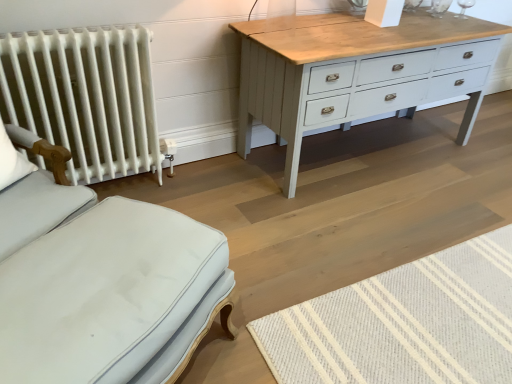
Question: Is white painted radiator at left to the right of natural wool mat at lower right from the viewer's perspective?

Choices:
 (A) no
 (B) yes

Answer: (A)

Question: From the image's perspective, is white painted radiator at left over natural wool mat at lower right?

Choices:
 (A) yes
 (B) no

Answer: (A)

Question: Is white painted radiator at left touching natural wool mat at lower right?

Choices:
 (A) no
 (B) yes

Answer: (A)

Question: Is natural wool mat at lower right at the back of white painted radiator at left?

Choices:
 (A) no
 (B) yes

Answer: (A)

Question: Is white painted radiator at left facing towards natural wool mat at lower right?

Choices:
 (A) no
 (B) yes

Answer: (A)

Question: Is white fabric pillow at left spatially inside light blue fabric ottoman at lower left, or outside of it?

Choices:
 (A) inside
 (B) outside

Answer: (B)

Question: Considering the positions of white fabric pillow at left and light blue fabric ottoman at lower left in the image, is white fabric pillow at left wider or thinner than light blue fabric ottoman at lower left?

Choices:
 (A) thin
 (B) wide

Answer: (A)

Question: From the image's perspective, is white fabric pillow at left positioned above or below light blue fabric ottoman at lower left?

Choices:
 (A) above
 (B) below

Answer: (A)

Question: Would you say white fabric pillow at left is to the left or to the right of light blue fabric ottoman at lower left in the picture?

Choices:
 (A) right
 (B) left

Answer: (B)

Question: Is natural wool mat at lower right inside or outside of white painted radiator at left?

Choices:
 (A) inside
 (B) outside

Answer: (B)

Question: Is point (504, 236) closer or farther from the camera than point (102, 72)?

Choices:
 (A) closer
 (B) farther

Answer: (B)

Question: Considering the positions of natural wool mat at lower right and white painted radiator at left in the image, is natural wool mat at lower right bigger or smaller than white painted radiator at left?

Choices:
 (A) big
 (B) small

Answer: (B)

Question: Looking at their shapes, would you say natural wool mat at lower right is wider or thinner than white painted radiator at left?

Choices:
 (A) wide
 (B) thin

Answer: (A)

Question: From the image's perspective, is light blue fabric ottoman at lower left positioned above or below natural wool mat at lower right?

Choices:
 (A) below
 (B) above

Answer: (B)

Question: Considering the positions of point (31, 147) and point (422, 380), is point (31, 147) closer or farther from the camera than point (422, 380)?

Choices:
 (A) farther
 (B) closer

Answer: (A)